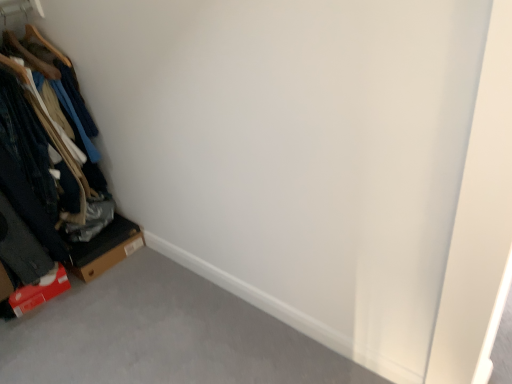
The width and height of the screenshot is (512, 384). I want to click on free space above brown cardboard box at lower left (from a real-world perspective), so click(105, 233).